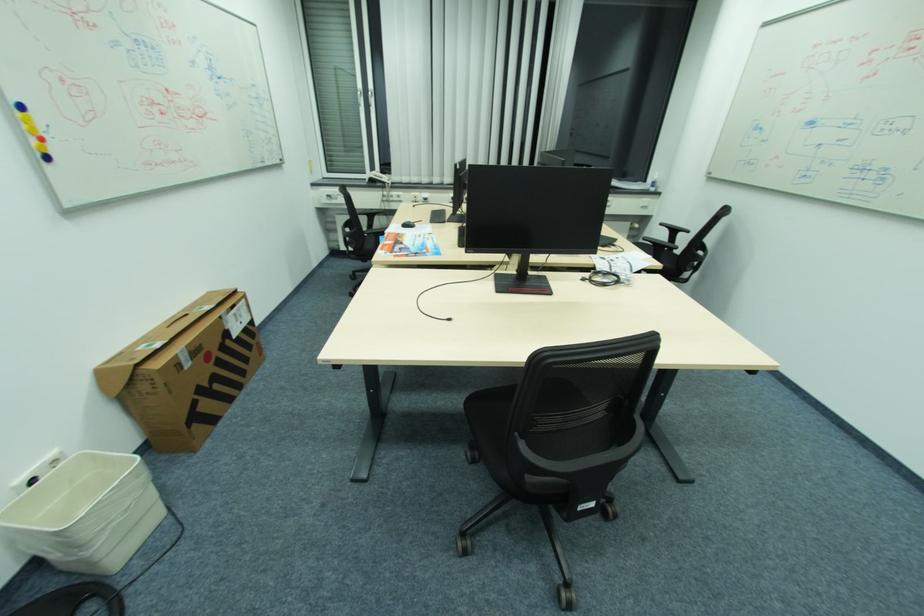
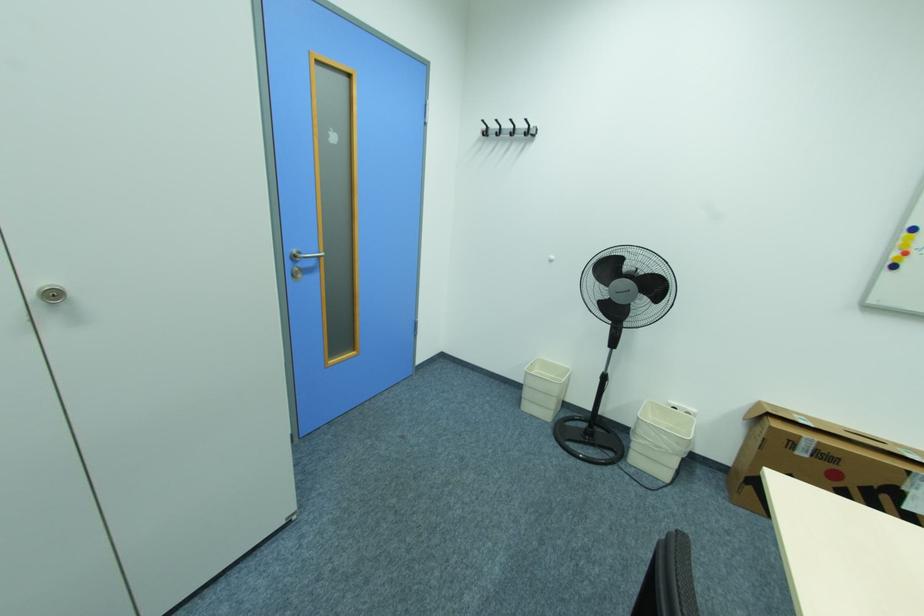
Find the pixel in the second image that matches [44,140] in the first image.

(910, 253)